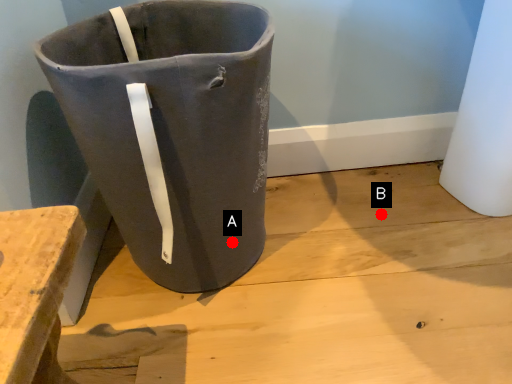
Question: Two points are circled on the image, labeled by A and B beside each circle. Among these points, which one is nearest to the camera?

Choices:
 (A) A is closer
 (B) B is closer

Answer: (A)